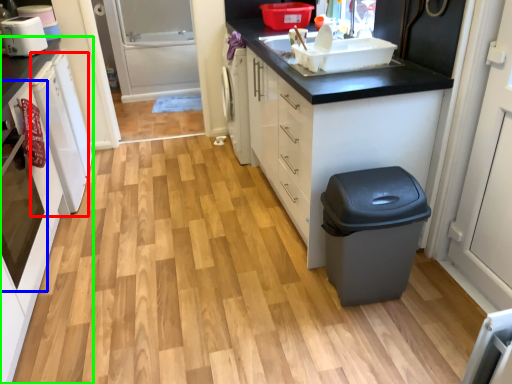
Question: Considering the real-world distances, which object is farthest from dish washer (highlighted by a red box)? oven (highlighted by a blue box) or cabinetry (highlighted by a green box)?

Choices:
 (A) oven
 (B) cabinetry

Answer: (A)